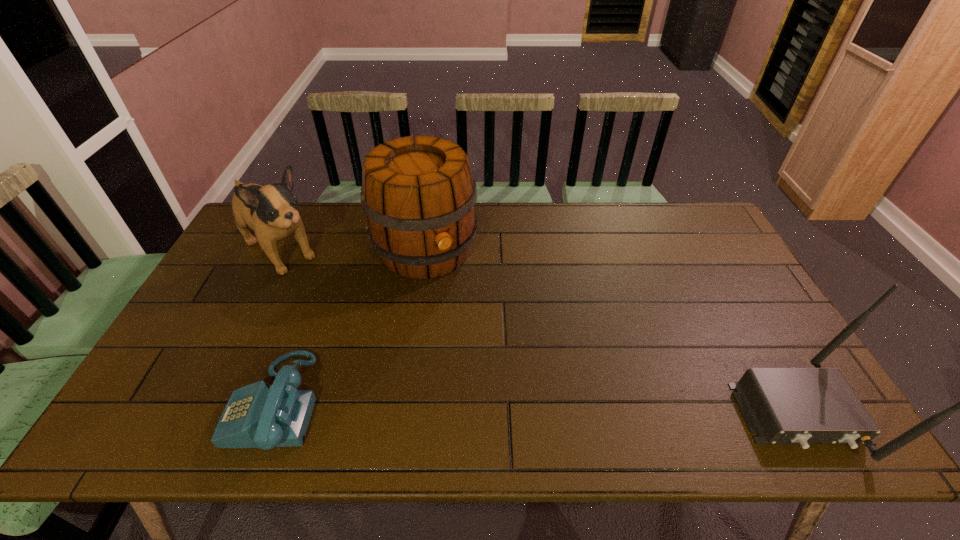
Image resolution: width=960 pixels, height=540 pixels. Find the location of `free point located at the face of the puppy`. free point located at the face of the puppy is located at coordinates (318, 282).

You are a GUI agent. You are given a task and a screenshot of the screen. Output one action in this format:
    pyautogui.click(x=<x>, y=<y>)
    Task: Click on the free spot located 0.310m at the face of the puppy
    
    Given the screenshot: What is the action you would take?
    pyautogui.click(x=366, y=324)

Locate an element on the screen. The image size is (960, 540). free region located 0.320m at the face of the puppy is located at coordinates (368, 326).

Locate an element on the screen. cider located at the far edge is located at coordinates (419, 198).

Locate an element on the screen. Image resolution: width=960 pixels, height=540 pixels. puppy that is at the far edge is located at coordinates (271, 211).

Where is `telephone at the near edge`? Image resolution: width=960 pixels, height=540 pixels. telephone at the near edge is located at coordinates [x=257, y=415].

Where is `router that is at the near edge`? router that is at the near edge is located at coordinates (803, 406).

Where is `object that is at the left edge`? This screenshot has width=960, height=540. object that is at the left edge is located at coordinates (271, 211).

At what (x,y) coordinates should I click in order to perform the action: click on object situated at the right edge. Please return your answer as a coordinate pair (x, y). Looking at the image, I should click on (803, 406).

Locate an element on the screen. object positioned at the far left corner is located at coordinates (271, 211).